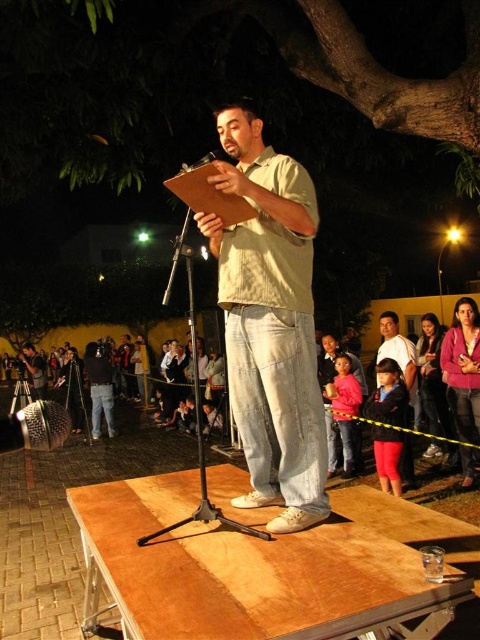
Question: Among these points, which one is farthest from the camera?

Choices:
 (A) (402, 365)
 (B) (95, 385)

Answer: (B)

Question: Does red cotton pants at lower right appear on the left side of matte black camera at lower left?

Choices:
 (A) no
 (B) yes

Answer: (A)

Question: Is light beige fabric shirt at center bigger than black fabric dress at lower left?

Choices:
 (A) no
 (B) yes

Answer: (B)

Question: Among these objects, which one is farthest from the camera?

Choices:
 (A) dark blue jeans at lower left
 (B) velvet pink sweater at right

Answer: (A)

Question: Which point appears farthest from the camera in this image?

Choices:
 (A) (183, 170)
 (B) (407, 461)

Answer: (B)

Question: Is matte black camera at lower left bigger than dark blue jeans at center?

Choices:
 (A) yes
 (B) no

Answer: (B)